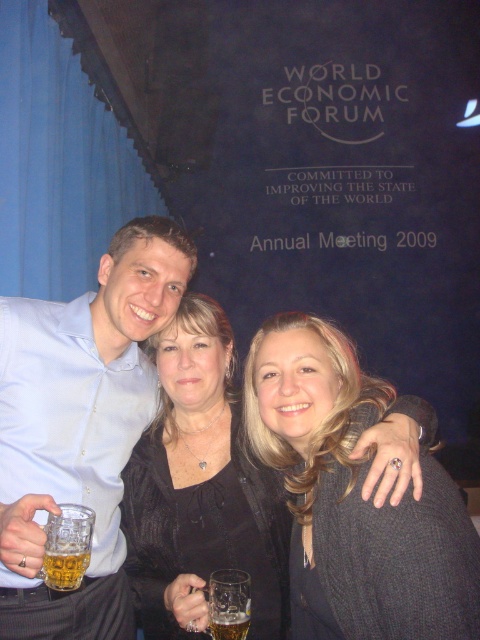
You are at a formal event and see the black fabric at center and the translucent glass at lower center. Which object is positioned higher from the ground?

The black fabric at center is located above the translucent glass at lower center, so it is positioned higher from the ground.

Consider the image. You are a photographer at the World Economic Forum Annual Meeting 2009. You notice two elements at the center of your frame, the matte blue shirt at center and the black fabric at center. Which element takes up more visual space in the image?

The black fabric at center occupies more visual space than the matte blue shirt at center because the matte blue shirt at center occupies less space than black fabric at center.

You are standing in front of the World Economic Forum Annual Meeting 2009 backdrop. You see a matte blue shirt at center and a translucent glass at lower center. Which object is closer to you?

The matte blue shirt at center is closer to you because it is further to the viewer than the translucent glass at lower center.